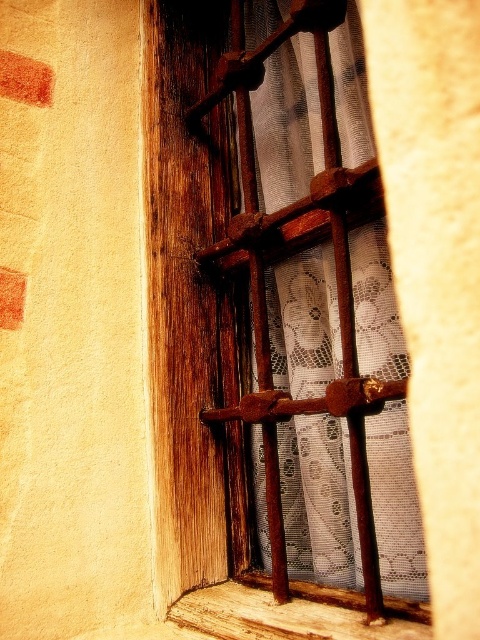
Which is below, rustic wood window frame at center or wooden window sill at lower center?

wooden window sill at lower center is below.

Which is more to the right, rustic wood window frame at center or wooden window sill at lower center?

wooden window sill at lower center is more to the right.

Where is `rustic wood window frame at center`? rustic wood window frame at center is located at coordinates (274, 330).